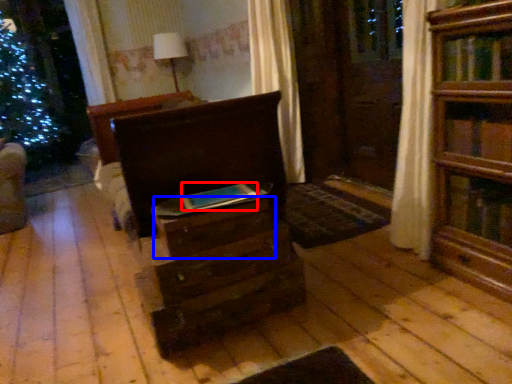
Question: Which of the following is the closest to the observer, book (highlighted by a red box) or drawer (highlighted by a blue box)?

Choices:
 (A) book
 (B) drawer

Answer: (B)